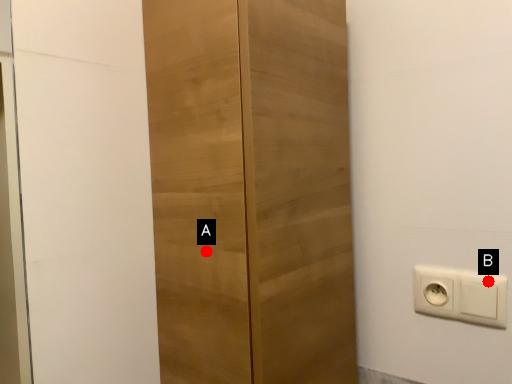
Question: Two points are circled on the image, labeled by A and B beside each circle. Which point is closer to the camera?

Choices:
 (A) A is closer
 (B) B is closer

Answer: (A)